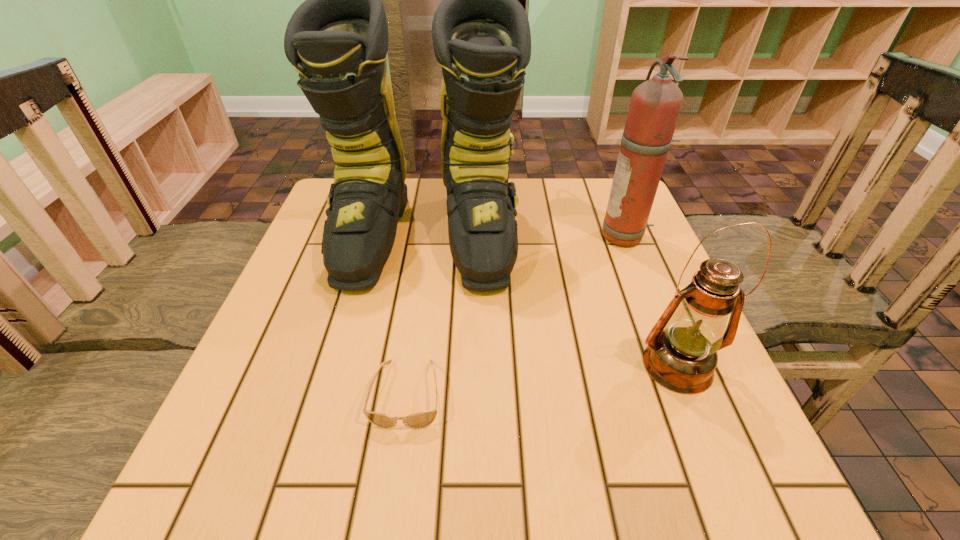
Image resolution: width=960 pixels, height=540 pixels. Identify the location of ski boots. (337, 40).

Identify the location of fire extinguisher. Image resolution: width=960 pixels, height=540 pixels. (655, 105).

In order to click on the second shortest object in this screenshot , I will do `click(681, 355)`.

I want to click on the shortest object, so click(420, 420).

This screenshot has height=540, width=960. I want to click on vacant position located on the front of the ski boots, so click(x=409, y=344).

Identify the location of vacant space located on the side of the fire extinguisher with the label and nozzle. (539, 237).

Where is `free space located on the side of the fire extinguisher with the label and nozzle`? The width and height of the screenshot is (960, 540). free space located on the side of the fire extinguisher with the label and nozzle is located at coordinates (526, 237).

You are a GUI agent. You are given a task and a screenshot of the screen. Output one action in this format:
    pyautogui.click(x=<x>, y=<y>)
    Task: Click on the blank space located 0.110m on the side of the fire extinguisher with the label and nozzle
    This screenshot has height=540, width=960.
    Given the screenshot: What is the action you would take?
    pyautogui.click(x=555, y=237)

Image resolution: width=960 pixels, height=540 pixels. I want to click on vacant area situated on the back of the third tallest object, so click(x=639, y=272).

Locate an element on the screen. ski boots that is at the far edge is located at coordinates (337, 40).